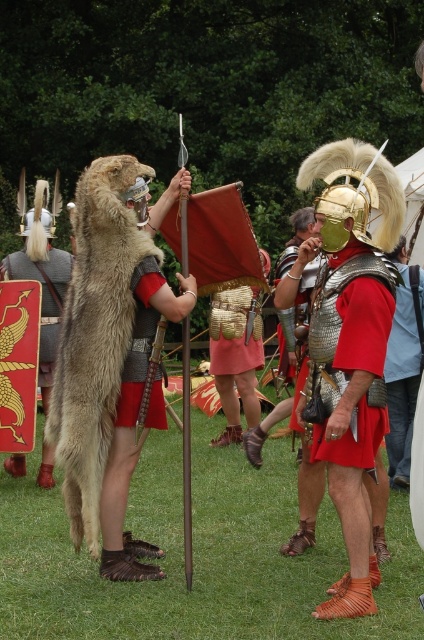
From the picture: You are a soldier in the Roman army preparing for battle. You need to grab your gold plated shield at center and metallic chainmail armor at center quickly. Can you reach both items within a 10 foot radius from your current position?

The distance between the metallic chainmail armor at center and gold plated shield at center is 9.58 feet, so yes, you can reach both items within a 10 foot radius from your current position since the distance between them is less than 10 feet.

You are a costume designer preparing for a play. You need to ensure that the red fabric skirt at center and the gold plated shield at center are arranged correctly. According to the scene, which object should be placed closer to the audience?

The red fabric skirt at center should be placed closer to the audience because it is in front of the gold plated shield at center in the scene.

You are a costume designer preparing for a historical play. You have two props in front of you, the metallic chainmail armor at center and the gold plated shield at center. The director wants to ensure that the shield can be easily carried by an actor wearing the armor. Based on their sizes, can the shield be comfortably held by someone wearing the armor?

The metallic chainmail armor at center is smaller than the gold plated shield at center. Since the shield is larger, it may be challenging for an actor wearing the smaller armor to comfortably hold it, as the shield could be too cumbersome in comparison.